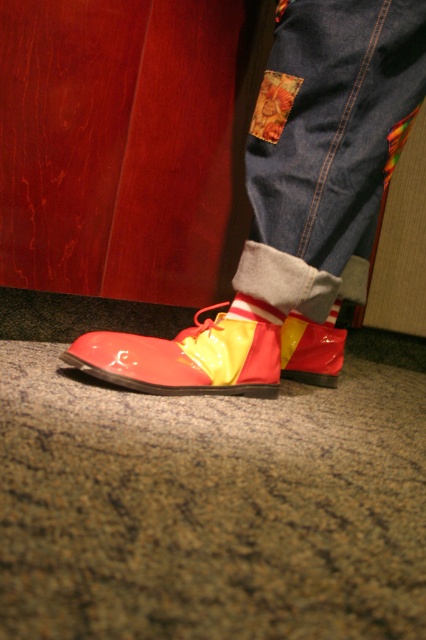
Is point (307, 346) positioned in front of point (227, 314)?

That is False.

Which is above, glossy patent leather shoe at lower center or yellow matte sock at lower center?

yellow matte sock at lower center is higher up.

Between point (282, 333) and point (273, 317), which one is positioned behind?

The point (282, 333) is more distant.

The height and width of the screenshot is (640, 426). Find the location of `glossy patent leather shoe at lower center`. glossy patent leather shoe at lower center is located at coordinates (311, 348).

Can you confirm if glossy patent leather shoes at lower center is positioned to the right of glossy patent leather shoe at lower left?

Indeed, glossy patent leather shoes at lower center is positioned on the right side of glossy patent leather shoe at lower left.

Is the position of glossy patent leather shoes at lower center less distant than that of glossy patent leather shoe at lower left?

No, glossy patent leather shoes at lower center is behind glossy patent leather shoe at lower left.

Does point (370, 44) come in front of point (259, 301)?

Yes, it is.

Identify the location of glossy patent leather shoes at lower center. (325, 141).

Who is more forward, [270,348] or [290,310]?

Positioned in front is point [270,348].

Does glossy patent leather shoe at lower left have a smaller size compared to glossy patent leather shoe at lower center?

No, glossy patent leather shoe at lower left is not smaller than glossy patent leather shoe at lower center.

Where is `glossy patent leather shoe at lower left`? This screenshot has height=640, width=426. glossy patent leather shoe at lower left is located at coordinates (192, 355).

Image resolution: width=426 pixels, height=640 pixels. In order to click on glossy patent leather shoe at lower left in this screenshot , I will do `click(192, 355)`.